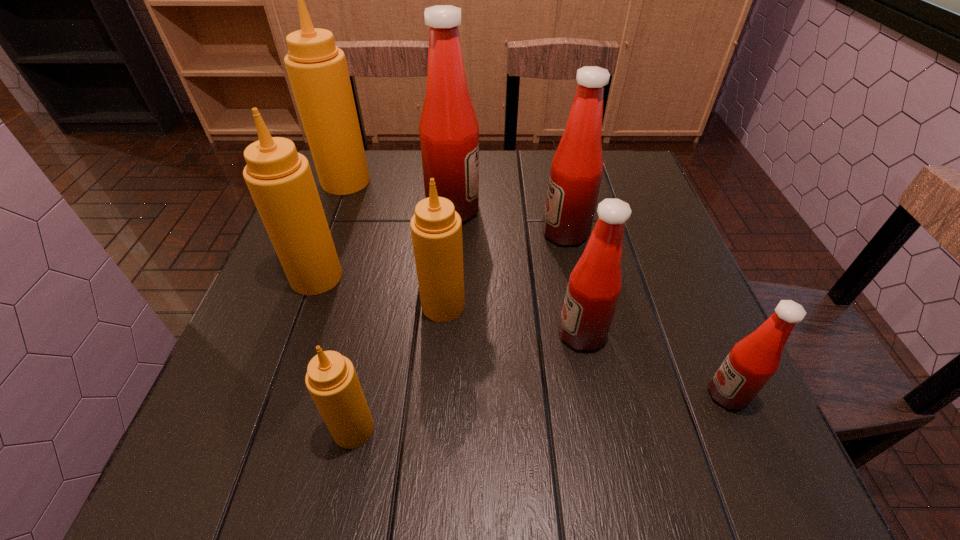
Identify the location of the biggest tan condiment. click(317, 69).

This screenshot has height=540, width=960. Find the location of `the biggest red condiment`. the biggest red condiment is located at coordinates (449, 132).

The height and width of the screenshot is (540, 960). Find the location of `the second biggest red condiment`. the second biggest red condiment is located at coordinates (576, 171).

This screenshot has width=960, height=540. In order to click on the second biggest tan condiment in this screenshot , I will do `click(280, 181)`.

The width and height of the screenshot is (960, 540). I want to click on the rightmost tan condiment, so click(x=436, y=228).

At what (x,y) coordinates should I click in order to perform the action: click on the second nearest red condiment. Please return your answer as a coordinate pair (x, y). This screenshot has height=540, width=960. Looking at the image, I should click on (594, 286).

This screenshot has width=960, height=540. Identify the location of the nearest tan condiment. (331, 379).

Locate an element on the screen. The width and height of the screenshot is (960, 540). the third condiment from left to right is located at coordinates (331, 379).

This screenshot has width=960, height=540. In order to click on the rightmost object in this screenshot , I will do `click(752, 361)`.

Locate an element on the screen. The image size is (960, 540). the smallest red condiment is located at coordinates (752, 361).